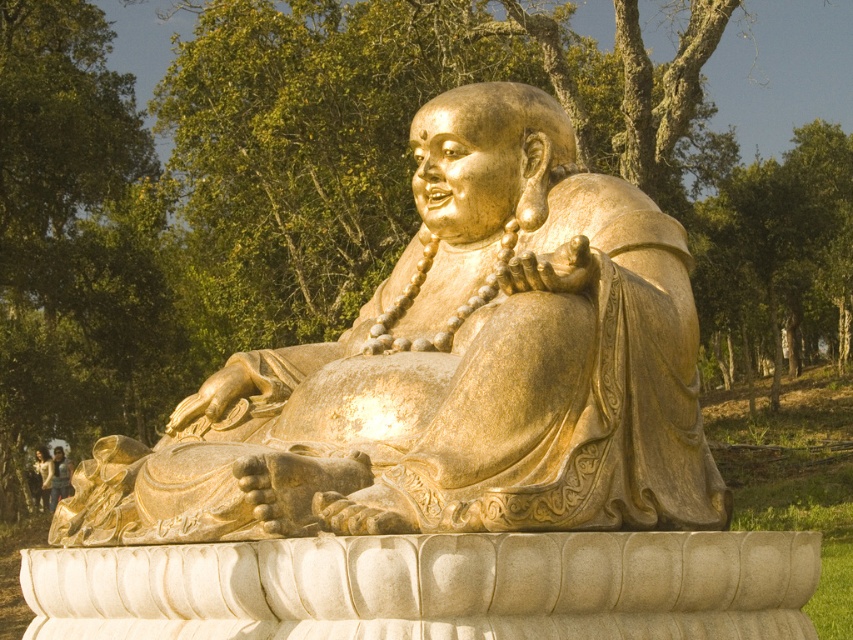
Is gold polished statue at center positioned at the back of light brown leather jacket at lower left?

That is False.

Between gold polished statue at center and light brown leather jacket at lower left, which one is positioned higher?

gold polished statue at center is higher up.

Is point (491, 365) less distant than point (44, 476)?

Yes, point (491, 365) is in front of point (44, 476).

Image resolution: width=853 pixels, height=640 pixels. Find the location of `gold polished statue at center`. gold polished statue at center is located at coordinates (453, 371).

Between gold polished statue at center and golden statue at center, which one has less height?

With less height is golden statue at center.

How much distance is there between gold polished statue at center and golden statue at center?

gold polished statue at center and golden statue at center are 395.68 feet apart.

Between point (624, 474) and point (62, 497), which one is positioned in front?

Point (624, 474) is in front.

What are the coordinates of `gold polished statue at center` in the screenshot? It's located at (453, 371).

Which is below, golden statue at center or light brown leather jacket at lower left?

Positioned lower is golden statue at center.

The width and height of the screenshot is (853, 640). What do you see at coordinates (59, 476) in the screenshot?
I see `golden statue at center` at bounding box center [59, 476].

What do you see at coordinates (59, 476) in the screenshot? Image resolution: width=853 pixels, height=640 pixels. I see `golden statue at center` at bounding box center [59, 476].

Where is `golden statue at center`? This screenshot has width=853, height=640. golden statue at center is located at coordinates coord(59,476).